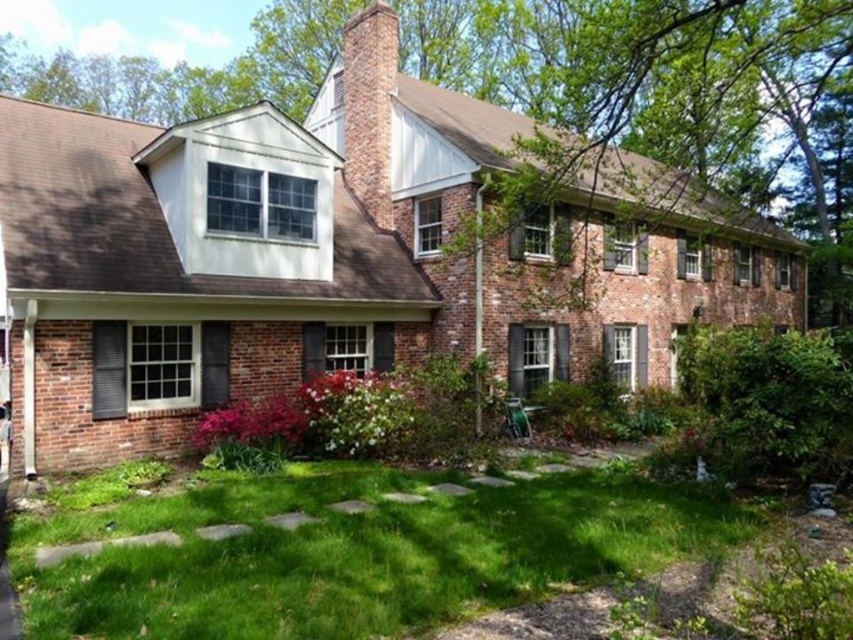
Can you confirm if green grass at lower center is wider than brick chimney at center?

Yes.

Is green grass at lower center shorter than brick chimney at center?

Indeed, green grass at lower center has a lesser height compared to brick chimney at center.

Which is behind, point (238, 568) or point (345, 125)?

The point (345, 125) is more distant.

Locate an element on the screen. This screenshot has height=640, width=853. green grass at lower center is located at coordinates (354, 554).